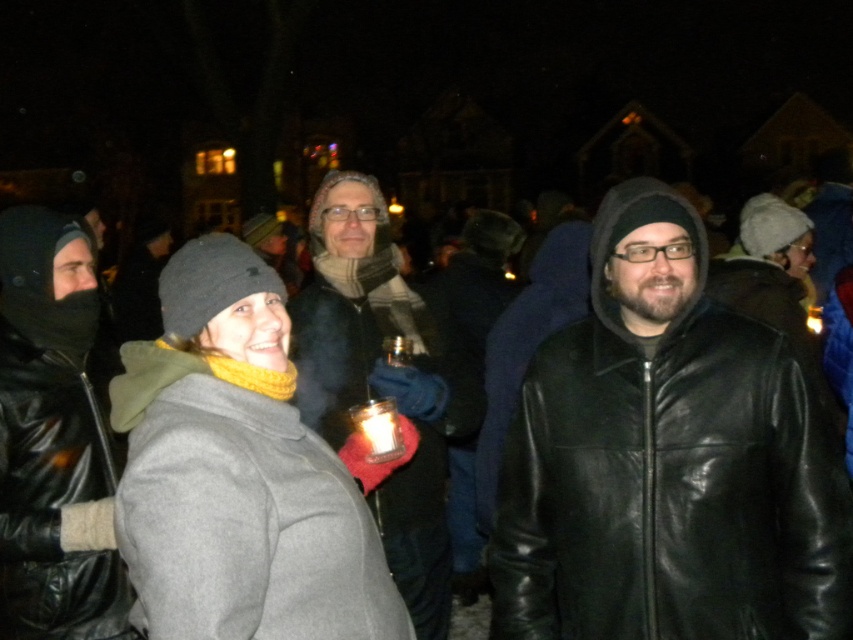
You are a photographer at this nighttime gathering and want to capture both the shiny black leather jacket at center and the matte black jacket at center in a single photo. The camera you are using has a maximum focus range of 5 feet. Can you include both jackets in the same frame without moving the camera?

The shiny black leather jacket at center is 5.29 feet away from the matte black jacket at center. Since the distance between them exceeds the camera maximum focus range of 5 feet, you cannot include both jackets in the same frame without moving the camera.